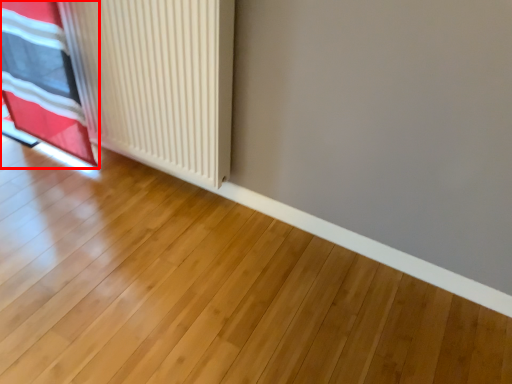
Question: In this image, where is curtain (annotated by the red box) located relative to radiator?

Choices:
 (A) right
 (B) left

Answer: (B)